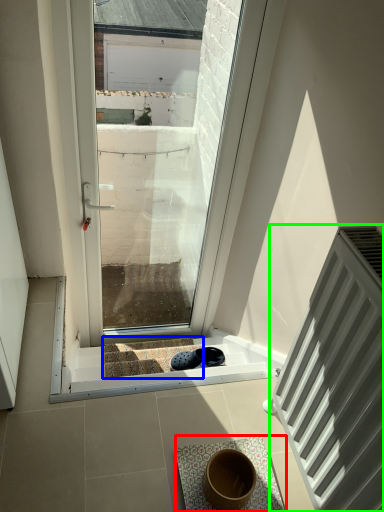
Question: Which object is positioned farthest from bath mat (highlighted by a red box)? Select from stairwell (highlighted by a blue box) and radiator (highlighted by a green box).

Choices:
 (A) stairwell
 (B) radiator

Answer: (A)